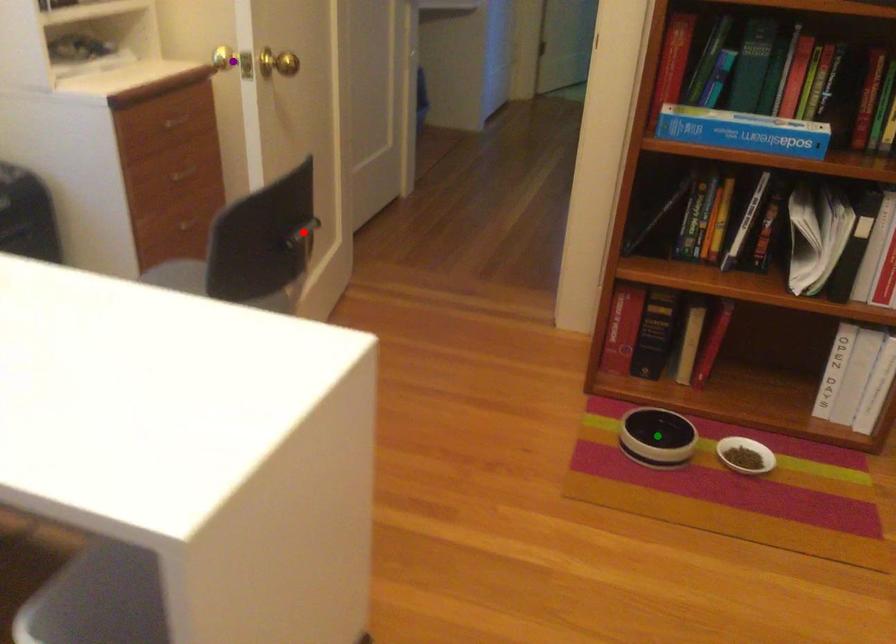
Order these from nearest to farthest:
A) red point
B) green point
C) purple point

purple point < green point < red point